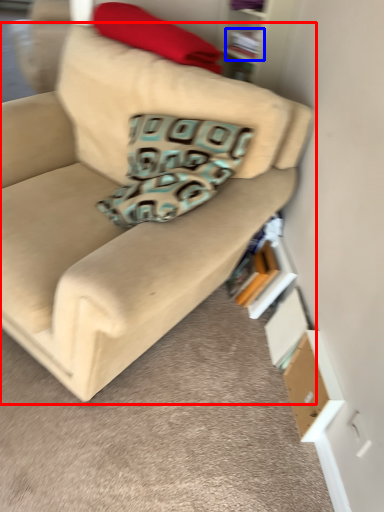
Question: Which object appears closest to the camera in this image, studio couch (highlighted by a red box) or book (highlighted by a blue box)?

Choices:
 (A) studio couch
 (B) book

Answer: (A)